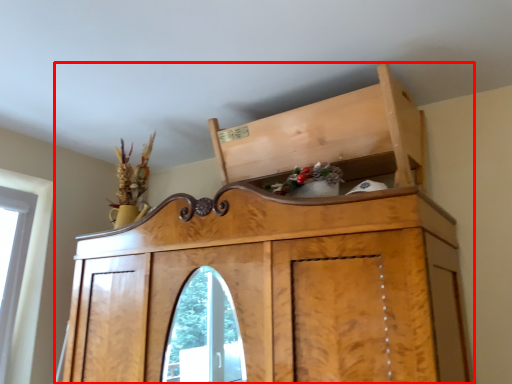
Question: Where is furniture (annotated by the red box) located in relation to cabinetry in the image?

Choices:
 (A) left
 (B) right

Answer: (A)